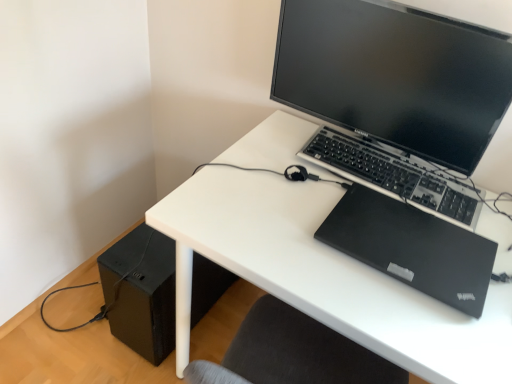
Question: In the image, is white matte desk at center on the left side or the right side of black plastic keyboard at center?

Choices:
 (A) left
 (B) right

Answer: (A)

Question: Considering the positions of point (228, 157) and point (407, 167), is point (228, 157) closer or farther from the camera than point (407, 167)?

Choices:
 (A) farther
 (B) closer

Answer: (B)

Question: Estimate the real-world distances between objects in this image. Which object is closer to the black plastic keyboard at center?

Choices:
 (A) white matte desk at center
 (B) matte black monitor at upper center
 (C) black matte laptop at upper right
 (D) black matte speaker at lower left

Answer: (C)

Question: Which is farther from the black matte speaker at lower left?

Choices:
 (A) black matte laptop at upper right
 (B) matte black monitor at upper center
 (C) white matte desk at center
 (D) black plastic keyboard at center

Answer: (B)